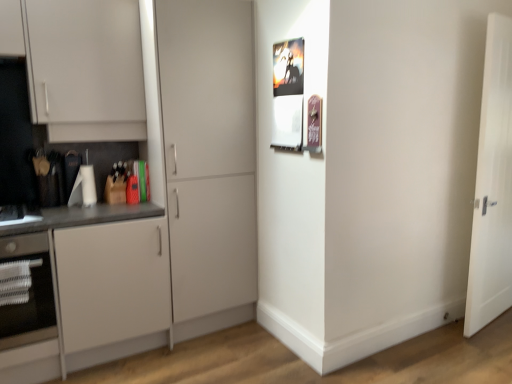
Question: Should I look upward or downward to see white glossy oven at lower left?

Choices:
 (A) up
 (B) down

Answer: (B)

Question: Are white glossy oven at lower left and white wooden door at right, which is the first door from right to left, beside each other?

Choices:
 (A) yes
 (B) no

Answer: (B)

Question: Does white glossy oven at lower left come in front of white wooden door at right, marked as the 2th door in a left-to-right arrangement?

Choices:
 (A) yes
 (B) no

Answer: (A)

Question: Is white glossy oven at lower left looking in the opposite direction of white wooden door at right, which is the first door from right to left?

Choices:
 (A) yes
 (B) no

Answer: (B)

Question: Is white glossy oven at lower left located outside white wooden door at right, which is the first door from right to left?

Choices:
 (A) yes
 (B) no

Answer: (A)

Question: Is white glossy oven at lower left further to the viewer compared to white wooden door at right, marked as the 2th door in a left-to-right arrangement?

Choices:
 (A) yes
 (B) no

Answer: (B)

Question: Is white glossy oven at lower left thinner than white wooden door at right, marked as the 2th door in a left-to-right arrangement?

Choices:
 (A) no
 (B) yes

Answer: (A)

Question: Considering the relative sizes of white wooden door at right, marked as the 2th door in a left-to-right arrangement, and white glossy oven at lower left in the image provided, is white wooden door at right, marked as the 2th door in a left-to-right arrangement, bigger than white glossy oven at lower left?

Choices:
 (A) no
 (B) yes

Answer: (B)

Question: Is white wooden door at right, marked as the 2th door in a left-to-right arrangement, in contact with white glossy oven at lower left?

Choices:
 (A) no
 (B) yes

Answer: (A)

Question: Is white wooden door at right, which is the first door from right to left, positioned far away from white glossy oven at lower left?

Choices:
 (A) no
 (B) yes

Answer: (B)

Question: Considering the relative positions of white wooden door at right, which is the first door from right to left, and white glossy oven at lower left in the image provided, is white wooden door at right, which is the first door from right to left, to the left of white glossy oven at lower left from the viewer's perspective?

Choices:
 (A) yes
 (B) no

Answer: (B)

Question: Is white wooden door at right, marked as the 2th door in a left-to-right arrangement, turned away from white glossy oven at lower left?

Choices:
 (A) no
 (B) yes

Answer: (A)

Question: Could you tell me if white wooden door at right, marked as the 2th door in a left-to-right arrangement, is turned towards white glossy oven at lower left?

Choices:
 (A) yes
 (B) no

Answer: (B)

Question: Is matte white cabinet at center, arranged as the 2th door when viewed from the right, not close to white glossy oven at lower left?

Choices:
 (A) no
 (B) yes

Answer: (A)